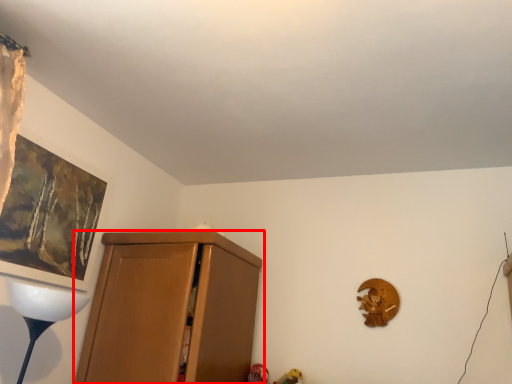
Question: From the image's perspective, considering the relative positions of cupboard (annotated by the red box) and picture frame in the image provided, where is cupboard (annotated by the red box) located with respect to the staircase?

Choices:
 (A) below
 (B) above

Answer: (A)